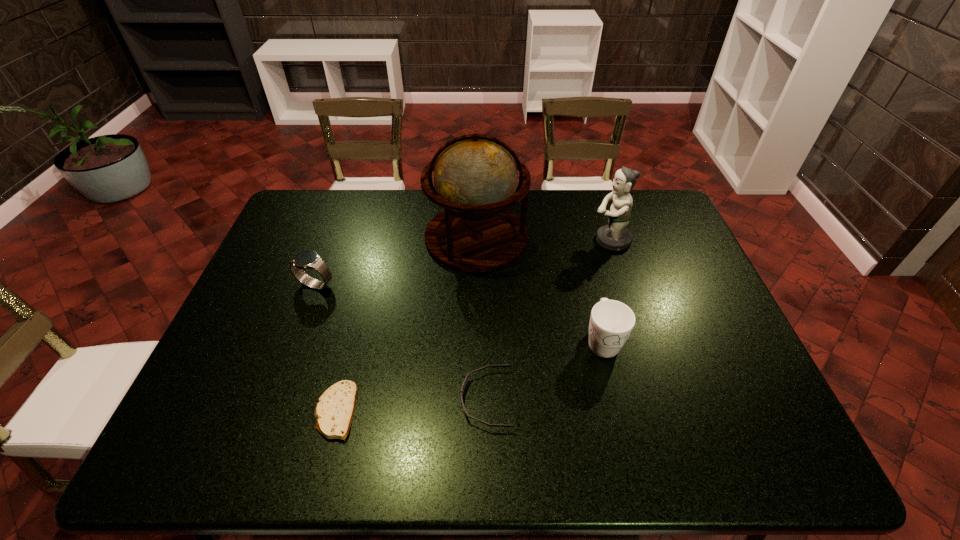
Locate an element on the screen. vacant position located 0.310m on the front-facing side of the figurine is located at coordinates (496, 240).

I want to click on free space located 0.360m on the front-facing side of the figurine, so click(481, 240).

Identify the location of free space located on the side of the third nearest object with the handle. The height and width of the screenshot is (540, 960). (622, 423).

The width and height of the screenshot is (960, 540). I want to click on vacant region located on the front of the third farthest object, so coord(281,378).

I want to click on vacant region located 0.110m on the front-facing side of the sunglasses, so click(x=414, y=399).

The image size is (960, 540). In order to click on vacant space located on the front-facing side of the sunglasses in this screenshot , I will do `click(317, 399)`.

Identify the location of vacant area located on the front-facing side of the sunglasses. The width and height of the screenshot is (960, 540). (342, 399).

Where is `blank space located 0.320m on the right of the shortest object`? This screenshot has height=540, width=960. blank space located 0.320m on the right of the shortest object is located at coordinates (493, 411).

At what (x,y) coordinates should I click in order to perform the action: click on globe present at the far edge. Please return your answer as a coordinate pair (x, y). The image size is (960, 540). Looking at the image, I should click on (475, 176).

Find the location of a particular element. The height and width of the screenshot is (540, 960). figurine that is at the far edge is located at coordinates (615, 236).